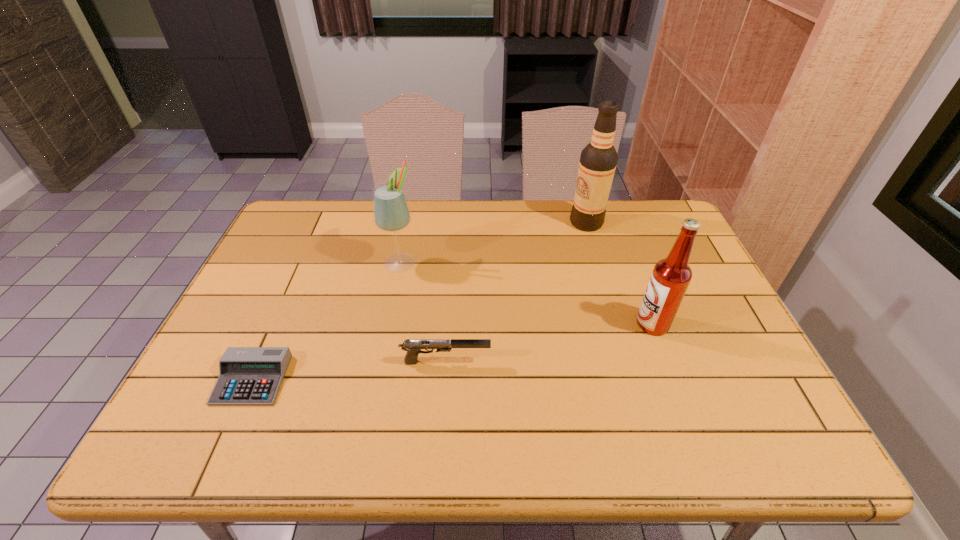
At what (x,y) coordinates should I click in order to perform the action: click on the farthest object. Please return your answer as a coordinate pair (x, y). The height and width of the screenshot is (540, 960). Looking at the image, I should click on (598, 160).

Locate an element on the screen. the farthest alcohol is located at coordinates (598, 160).

The height and width of the screenshot is (540, 960). In order to click on the leftmost alcohol in this screenshot , I will do `click(391, 213)`.

You are a GUI agent. You are given a task and a screenshot of the screen. Output one action in this format:
    pyautogui.click(x=<x>, y=<y>)
    Task: Click on the second farthest alcohol
    This screenshot has height=540, width=960.
    Given the screenshot: What is the action you would take?
    pyautogui.click(x=391, y=213)

You are a GUI agent. You are given a task and a screenshot of the screen. Output one action in this format:
    pyautogui.click(x=<x>, y=<y>)
    Task: Click on the nearest alcohol
    Image resolution: width=960 pixels, height=540 pixels.
    Given the screenshot: What is the action you would take?
    pyautogui.click(x=671, y=276)

The height and width of the screenshot is (540, 960). I want to click on gun, so click(413, 347).

What are the coordinates of `calculator` in the screenshot? It's located at (248, 376).

Image resolution: width=960 pixels, height=540 pixels. I want to click on the shortest object, so click(x=248, y=376).

Find the location of a particular element. free spot located 0.360m on the label of the tallest object is located at coordinates (462, 222).

This screenshot has height=540, width=960. I want to click on vacant space located 0.080m on the label of the tallest object, so click(545, 222).